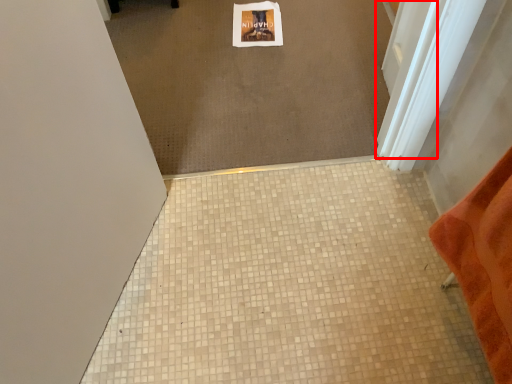
Question: From the image's perspective, considering the relative positions of screen door (annotated by the red box) and tile in the image provided, where is screen door (annotated by the red box) located with respect to the staircase?

Choices:
 (A) above
 (B) below

Answer: (A)